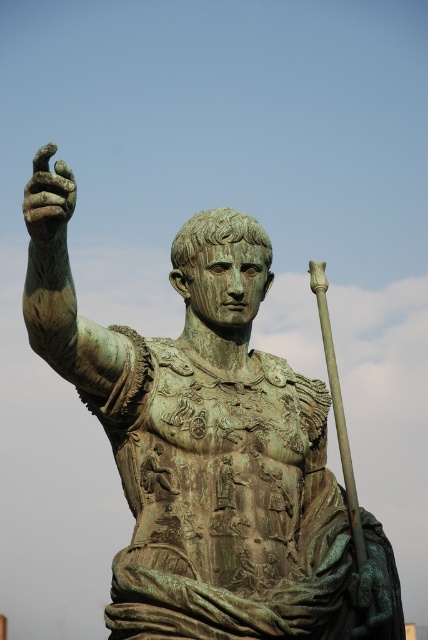
Question: Which point is closer to the camera?

Choices:
 (A) (47, 237)
 (B) (243, 621)

Answer: (A)

Question: Which object is closer to the camera taking this photo?

Choices:
 (A) green patina hand at upper left
 (B) green patina bronze statue at center

Answer: (A)

Question: Which point is farther from the camera taking this photo?

Choices:
 (A) (74, 189)
 (B) (382, 573)

Answer: (B)

Question: Can you confirm if green patina bronze statue at center is wider than green patina hand at upper left?

Choices:
 (A) yes
 (B) no

Answer: (A)

Question: Does green patina bronze statue at center come behind green patina hand at upper left?

Choices:
 (A) no
 (B) yes

Answer: (B)

Question: Is green patina bronze statue at center behind green patina hand at upper left?

Choices:
 (A) no
 (B) yes

Answer: (B)